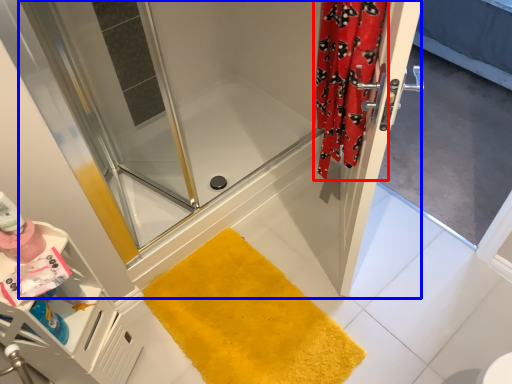
Question: Which object appears farthest to the camera in this image, shower curtain (highlighted by a red box) or shower door (highlighted by a blue box)?

Choices:
 (A) shower curtain
 (B) shower door

Answer: (B)